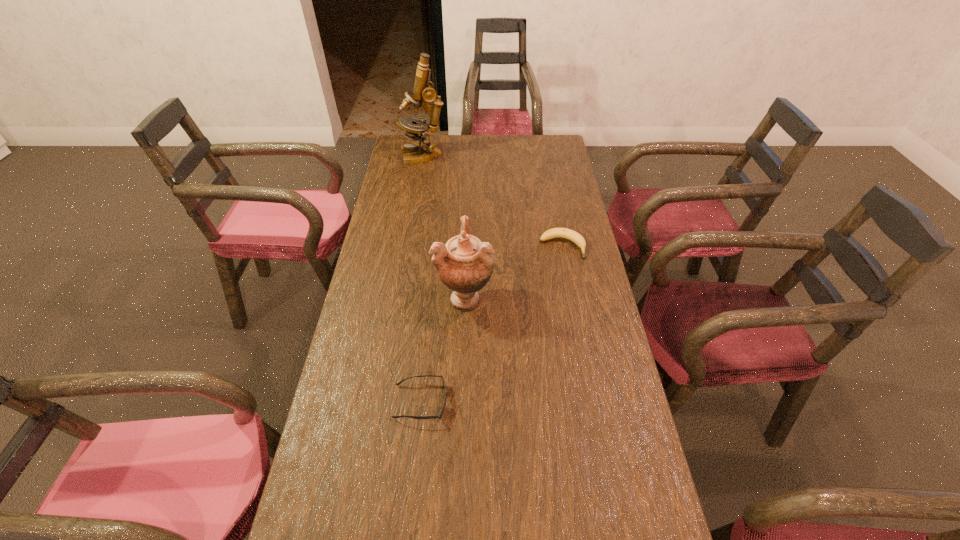
You are a GUI agent. You are given a task and a screenshot of the screen. Output one action in this format:
    pyautogui.click(x=<x>, y=<y>)
    Task: Click on the free point between the farthest object and the second nearest object
    The image size is (960, 540).
    Given the screenshot: What is the action you would take?
    pyautogui.click(x=444, y=226)

The height and width of the screenshot is (540, 960). Identify the location of empty space between the farthest object and the third nearest object. pos(492,201).

The width and height of the screenshot is (960, 540). Identify the location of vacant space in between the second nearest object and the nearest object. (443, 349).

Where is `free spot between the microscope and the third shortest object`? The image size is (960, 540). free spot between the microscope and the third shortest object is located at coordinates (444, 226).

The height and width of the screenshot is (540, 960). I want to click on free area in between the banana and the third shortest object, so click(514, 272).

Identify the location of blank region between the second nearest object and the nearest object. The image size is (960, 540). (443, 349).

This screenshot has height=540, width=960. What are the coordinates of `vacant area that lies between the tallest object and the banana` in the screenshot? It's located at (492, 201).

The image size is (960, 540). I want to click on vacant space that is in between the farthest object and the sunglasses, so click(422, 279).

Identify the location of free spot between the banana and the second nearest object. This screenshot has height=540, width=960. (514, 272).

Where is `free space between the banana and the urn`? free space between the banana and the urn is located at coordinates (514, 272).